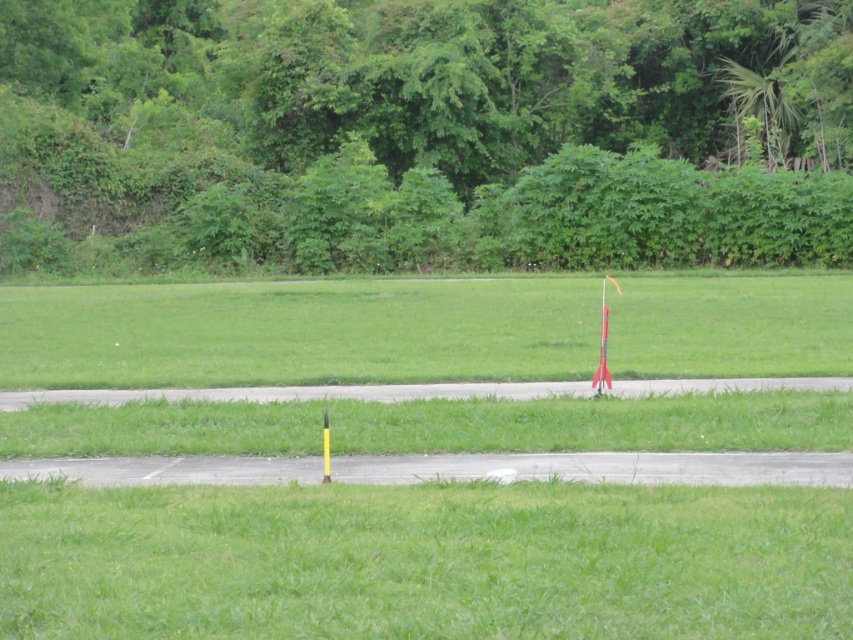
Question: Which object appears farthest from the camera in this image?

Choices:
 (A) green leafy tree at upper center
 (B) green grassy at lower center
 (C) yellow matte rocket at center

Answer: (A)

Question: Can you confirm if green grassy at lower center is positioned to the right of green grass at center?

Choices:
 (A) no
 (B) yes

Answer: (B)

Question: Which point appears farthest from the camera in this image?

Choices:
 (A) (323, 410)
 (B) (0, 77)
 (C) (734, 536)

Answer: (B)

Question: Does green leafy tree at upper center appear under yellow matte rocket at center?

Choices:
 (A) yes
 (B) no

Answer: (B)

Question: Which object appears closest to the camera in this image?

Choices:
 (A) yellow matte rocket at center
 (B) green grassy at lower center
 (C) green grass at center
 (D) green leafy tree at upper center

Answer: (B)

Question: Does green grassy at lower center appear over yellow matte rocket at center?

Choices:
 (A) no
 (B) yes

Answer: (A)